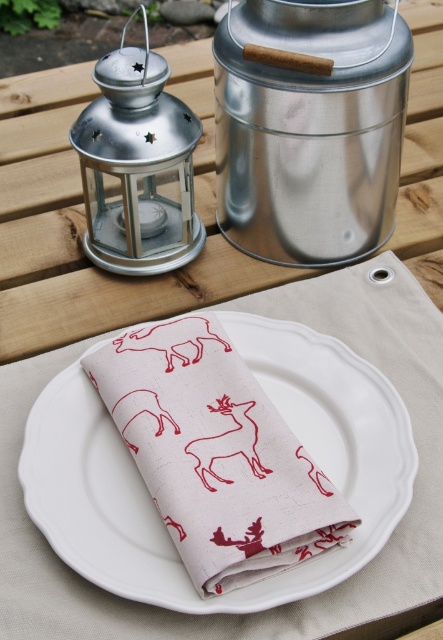
The image size is (443, 640). Identify the location of metallic silver canister at upper center. (310, 128).

Is metallic silver canister at upper center further to camera compared to metallic lantern at upper left?

Yes, it is.

Who is more forward, (330,172) or (104,161)?

Positioned in front is point (104,161).

Where is `metallic silver canister at upper center`? The width and height of the screenshot is (443, 640). metallic silver canister at upper center is located at coordinates (310, 128).

Does point (97, 548) lie in front of point (127, 102)?

Yes.

Who is lower down, white ceramic plate at center or metallic lantern at upper left?

white ceramic plate at center is lower down.

The height and width of the screenshot is (640, 443). I want to click on white ceramic plate at center, so click(291, 428).

Does metallic silver canister at upper center appear on the right side of white ceramic plate at center?

Correct, you'll find metallic silver canister at upper center to the right of white ceramic plate at center.

Who is positioned more to the left, metallic silver canister at upper center or white ceramic plate at center?

From the viewer's perspective, white ceramic plate at center appears more on the left side.

Is point (229, 72) positioned before point (37, 508)?

No, it is not.

Where is `metallic silver canister at upper center`? The height and width of the screenshot is (640, 443). metallic silver canister at upper center is located at coordinates (310, 128).